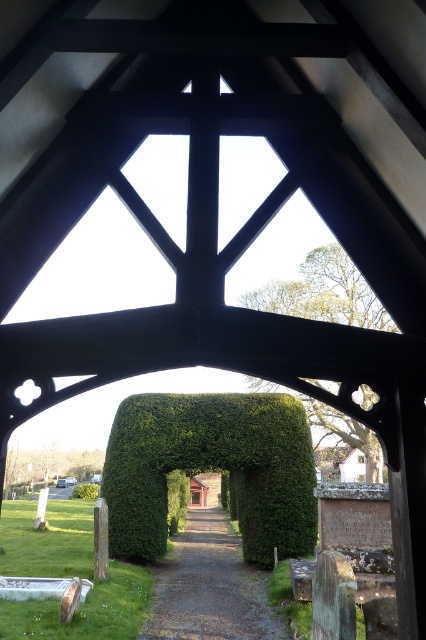
Question: Among these points, which one is farthest from the camera?

Choices:
 (A) (118, 536)
 (B) (180, 621)

Answer: (A)

Question: In this image, where is green leafy hedge at center located relative to green hedge at center?

Choices:
 (A) below
 (B) above

Answer: (B)

Question: Does green leafy hedge at center have a smaller size compared to green hedge at center?

Choices:
 (A) yes
 (B) no

Answer: (A)

Question: Is green leafy hedge at center smaller than green hedge at center?

Choices:
 (A) no
 (B) yes

Answer: (B)

Question: Among these objects, which one is nearest to the camera?

Choices:
 (A) green leafy hedge at center
 (B) green hedge at center

Answer: (B)